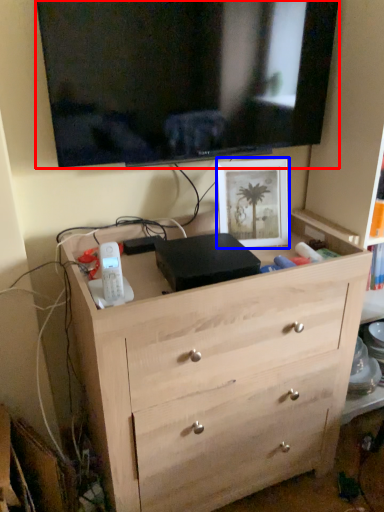
Question: Which point is further to the camera, television (highlighted by a red box) or picture frame (highlighted by a blue box)?

Choices:
 (A) television
 (B) picture frame

Answer: (B)